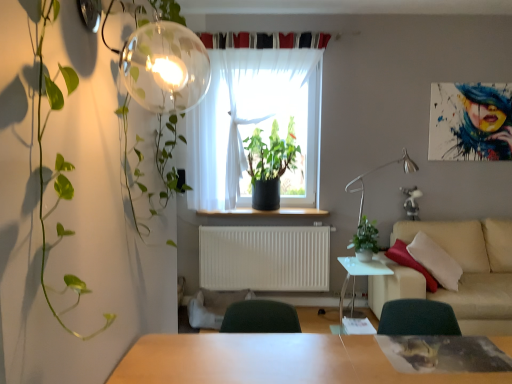
Describe the element at coordinates (47, 121) in the screenshot. I see `green leafy plant at left` at that location.

At what (x,y) coordinates should I click in order to perform the action: click on transparent glass globe at upper left. Please return your answer as a coordinate pair (x, y). The image size is (512, 384). Looking at the image, I should click on (155, 57).

The height and width of the screenshot is (384, 512). Describe the element at coordinates (155, 57) in the screenshot. I see `transparent glass globe at upper left` at that location.

This screenshot has width=512, height=384. Describe the element at coordinates (359, 275) in the screenshot. I see `white glossy side table at center` at that location.

What do you see at coordinates (365, 240) in the screenshot? I see `green matte plant at center, the 2th houseplant positioned from the left` at bounding box center [365, 240].

You are a GUI agent. You are given a task and a screenshot of the screen. Output one action in this format:
    pyautogui.click(x=<x>, y=<y>)
    Task: Click on the green leafy plant at left
    
    Given the screenshot: What is the action you would take?
    click(x=47, y=121)

Is white sheer curtain at center next to green matte plant at center, which is counted as the first houseplant, starting from the top?

No, white sheer curtain at center is not making contact with green matte plant at center, which is counted as the first houseplant, starting from the top.

Does white sheer curtain at center turn towards green matte plant at center, the 2th houseplant from the right?

Yes, white sheer curtain at center is facing green matte plant at center, the 2th houseplant from the right.

In the scene shown: Between white sheer curtain at center and green matte plant at center, the 2th houseplant from the right, which one appears on the right side from the viewer's perspective?

green matte plant at center, the 2th houseplant from the right.

Which of these two, wooden at center or white glossy side table at center, is wider?

Wider between the two is white glossy side table at center.

Can you see wooden at center touching white glossy side table at center?

wooden at center is not next to white glossy side table at center, and they're not touching.

From the image's perspective, is wooden at center above white glossy side table at center?

Yes, from the image's perspective, wooden at center is above white glossy side table at center.

How far apart are wooden at center and white glossy side table at center?

wooden at center and white glossy side table at center are 34.88 inches apart.

Are silver metallic table lamp at right and beige fabric couch at right making contact?

No, silver metallic table lamp at right is not next to beige fabric couch at right.

Does silver metallic table lamp at right appear on the right side of beige fabric couch at right?

Incorrect, silver metallic table lamp at right is not on the right side of beige fabric couch at right.

Can beige fabric couch at right be found inside silver metallic table lamp at right?

That's incorrect, beige fabric couch at right is not inside silver metallic table lamp at right.

From the image's perspective, who appears lower, silver metallic table lamp at right or beige fabric couch at right?

beige fabric couch at right, from the image's perspective.

Is white glossy side table at center far away from transparent glass globe at upper left?

white glossy side table at center is positioned a significant distance from transparent glass globe at upper left.

Which object is thinner, white glossy side table at center or transparent glass globe at upper left?

With smaller width is transparent glass globe at upper left.

How different are the orientations of white glossy side table at center and transparent glass globe at upper left in degrees?

They differ by 90.1 degrees in their facing directions.

From the picture: From the image's perspective, is white glossy side table at center above transparent glass globe at upper left?

No, from the image's perspective, white glossy side table at center is not above transparent glass globe at upper left.

Considering the positions of objects white glossy side table at center and beige fabric couch at right in the image provided, who is more to the right, white glossy side table at center or beige fabric couch at right?

beige fabric couch at right.

Is white glossy side table at center spatially inside beige fabric couch at right, or outside of it?

The correct answer is: outside.

Is point (352, 263) positioned after point (374, 305)?

That is False.

Which object is closer to the camera taking this photo, white glossy side table at center or beige fabric couch at right?

Positioned in front is beige fabric couch at right.

From a real-world perspective, is green leafy plant at left positioned under white sheer curtain at center based on gravity?

Yes, from a real-world perspective, green leafy plant at left is under white sheer curtain at center.

Is green leafy plant at left located outside white sheer curtain at center?

That's correct, green leafy plant at left is outside of white sheer curtain at center.

Is green leafy plant at left aimed at white sheer curtain at center?

No, green leafy plant at left is not aimed at white sheer curtain at center.

Considering the sizes of green leafy plant at left and white sheer curtain at center in the image, is green leafy plant at left taller or shorter than white sheer curtain at center?

Clearly, green leafy plant at left is shorter compared to white sheer curtain at center.

Identify the location of cocktail table below the white matte radiator at center (from the image's perspective). This screenshot has height=384, width=512. (359, 275).

Would you say white matte radiator at center is outside white glossy side table at center?

white matte radiator at center lies outside white glossy side table at center's area.

Is white matte radiator at center oriented away from white glossy side table at center?

white matte radiator at center does not have its back to white glossy side table at center.

From the picture: Can you see white matte radiator at center touching white glossy side table at center?

No, white matte radiator at center is not making contact with white glossy side table at center.

Locate an element on the screen. The height and width of the screenshot is (384, 512). curtain that is in front of the green matte plant at center, which ranks as the 1th houseplant in left-to-right order is located at coordinates (254, 124).

Identify the location of cocktail table lying on the right of wooden at center. (359, 275).

Looking at the image, which one is located closer to green matte plant at center, the 2th houseplant from the right, wooden at center or green matte plant at center, positioned as the second houseplant in top-to-bottom order?

wooden at center.

Looking at the image, which one is located further to wooden at center, transparent glass globe at upper left or green matte plant at center, which is the second houseplant from front to back?

transparent glass globe at upper left.

Estimate the real-world distances between objects in this image. Which object is further from transparent glass globe at upper left, wooden at center or silver metallic table lamp at right?

silver metallic table lamp at right.

When comparing their distances from green matte plant at center, which is the 1th houseplant in front-to-back order, does white glossy side table at center or silver metallic table lamp at right seem further?

silver metallic table lamp at right lies further to green matte plant at center, which is the 1th houseplant in front-to-back order, than the other object.

From the image, which object appears to be farther from green leafy plant at left, transparent glass globe at upper left or beige fabric couch at right?

Among the two, beige fabric couch at right is located further to green leafy plant at left.

Considering their positions, is silver metallic table lamp at right positioned further to wooden at center than transparent glass globe at upper left?

Among the two, transparent glass globe at upper left is located further to wooden at center.

Looking at this image, considering their positions, is wooden at center positioned further to green matte plant at center, which is the first houseplant in right-to-left order, than white matte radiator at center?

Based on the image, white matte radiator at center appears to be further to green matte plant at center, which is the first houseplant in right-to-left order.

When comparing their distances from beige fabric couch at right, does white glossy side table at center or white matte radiator at center seem further?

white matte radiator at center is positioned further to the anchor beige fabric couch at right.

Image resolution: width=512 pixels, height=384 pixels. What are the coordinates of `cocktail table between white matte radiator at center and green matte plant at center, the 2th houseplant positioned from the back` in the screenshot? It's located at (359, 275).

This screenshot has width=512, height=384. In order to click on houseplant between transparent glass globe at upper left and silver metallic table lamp at right along the z-axis in this screenshot , I will do [x=365, y=240].

This screenshot has height=384, width=512. I want to click on cocktail table located between transparent glass globe at upper left and green matte plant at center, which is the first houseplant in right-to-left order, in the depth direction, so click(359, 275).

Locate an element on the screen. The width and height of the screenshot is (512, 384). table lamp located between green leafy plant at left and white sheer curtain at center in the depth direction is located at coordinates (378, 169).